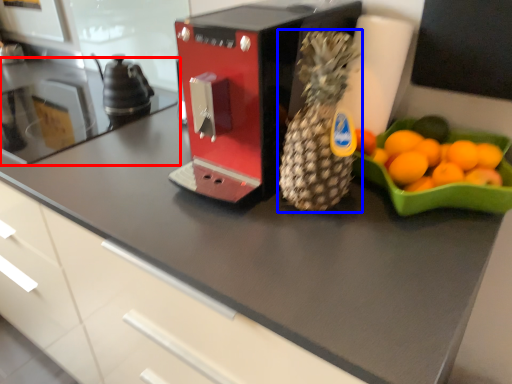
Question: Which object is further to the camera taking this photo, countertop (highlighted by a red box) or pineapple (highlighted by a blue box)?

Choices:
 (A) countertop
 (B) pineapple

Answer: (A)